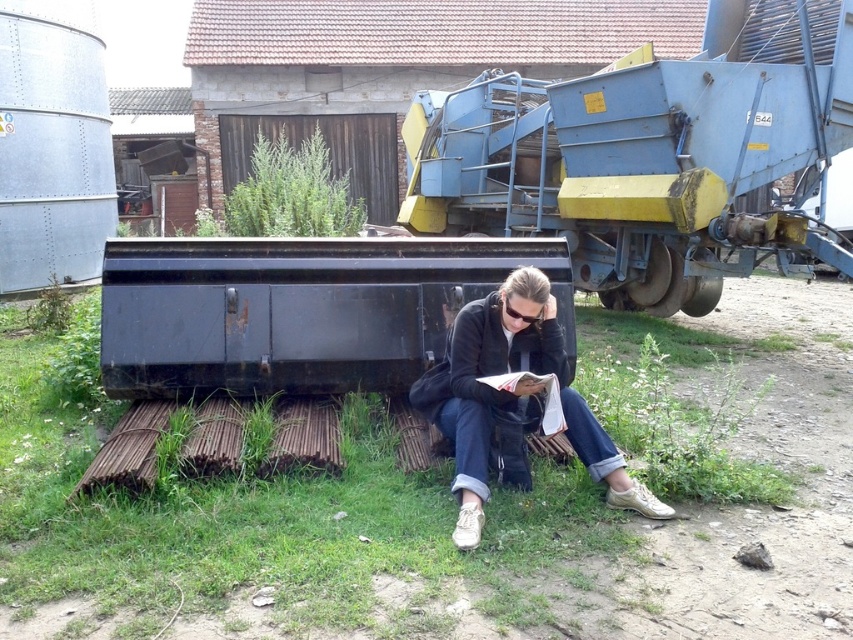
Question: Does green grass at lower center have a lesser width compared to denim jeans at lower center?

Choices:
 (A) no
 (B) yes

Answer: (B)

Question: Which point is closer to the camera taking this photo?

Choices:
 (A) (525, 337)
 (B) (683, 541)

Answer: (B)

Question: Which object appears farthest from the camera in this image?

Choices:
 (A) denim jeans at lower center
 (B) green grass at lower center

Answer: (B)

Question: Can you confirm if green grass at lower center is wider than denim jeans at lower center?

Choices:
 (A) no
 (B) yes

Answer: (A)

Question: Is green grass at lower center below denim jeans at lower center?

Choices:
 (A) no
 (B) yes

Answer: (B)